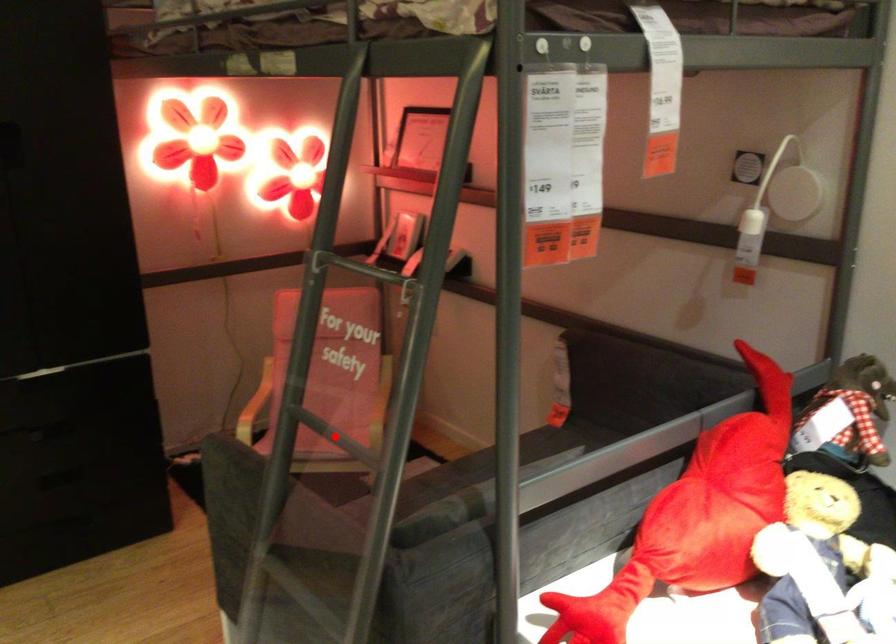
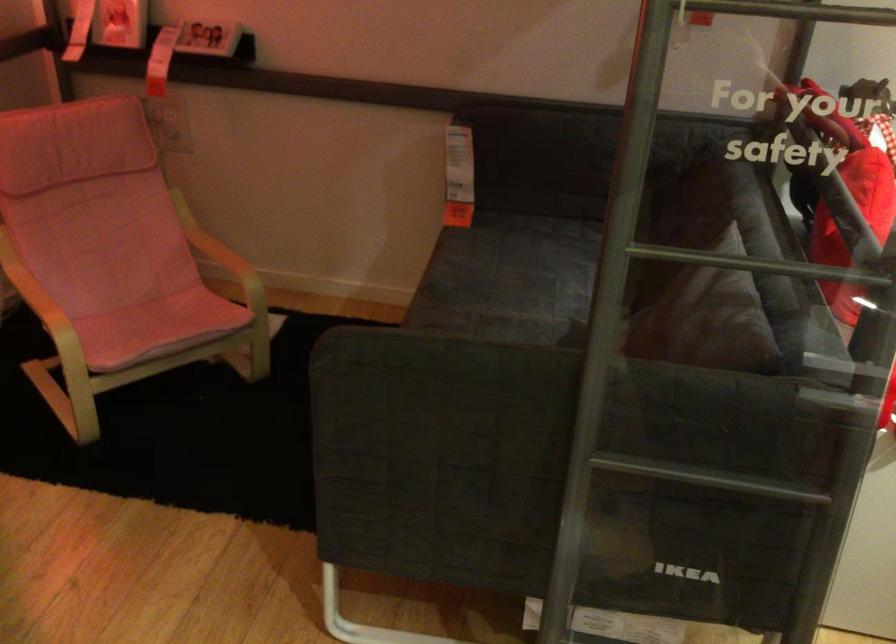
The point at the highlighted location is marked in the first image. Where is the corresponding point in the second image?

(760, 263)